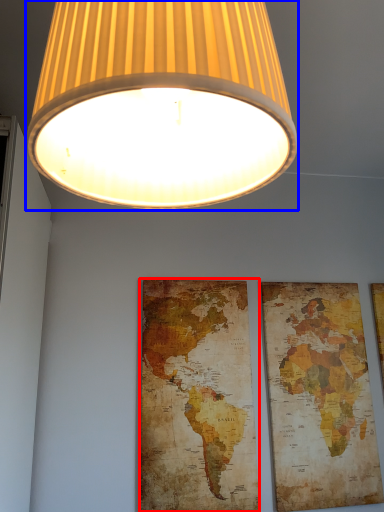
Question: Among these objects, which one is farthest to the camera, map (highlighted by a red box) or lamp (highlighted by a blue box)?

Choices:
 (A) map
 (B) lamp

Answer: (A)